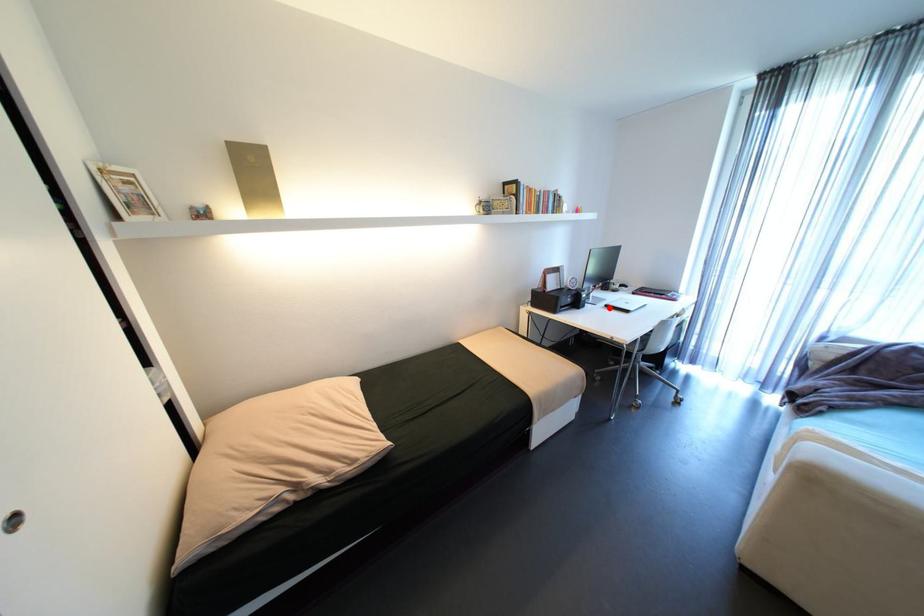
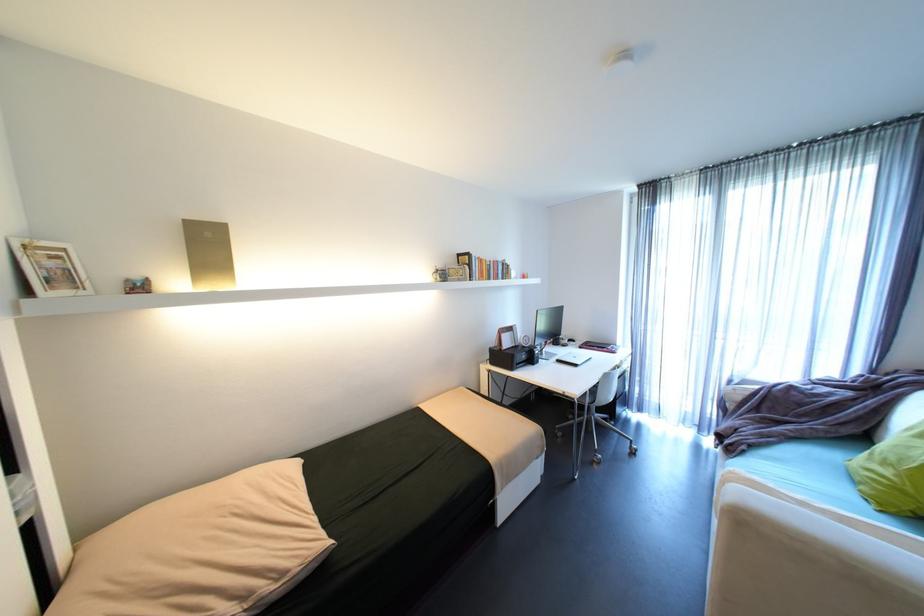
Question: I am providing you with two images of the same scene from different viewpoints. Image1 has a red point marked. In image2, the corresponding 3D location appears at what relative position? Reply with the corresponding letter.

Choices:
 (A) Closer
 (B) Farther

Answer: (B)